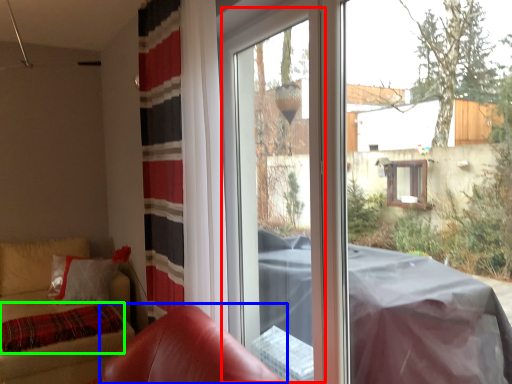
Question: Which object is positioned farthest from screen door (highlighted by a red box)? Select from armchair (highlighted by a blue box) and blanket (highlighted by a green box).

Choices:
 (A) armchair
 (B) blanket

Answer: (B)